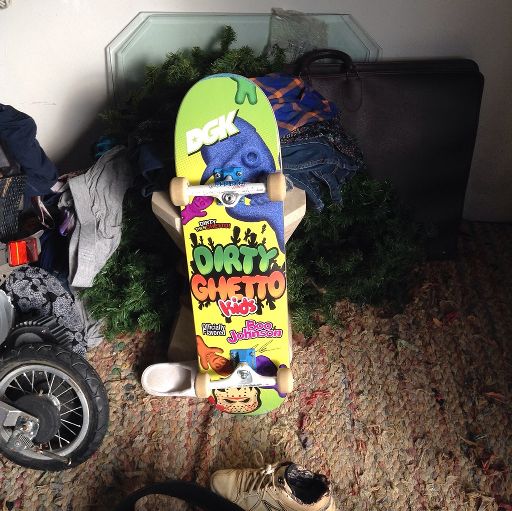
In order to click on christmas tree in this screenshot , I will do `click(136, 278)`, `click(318, 276)`.